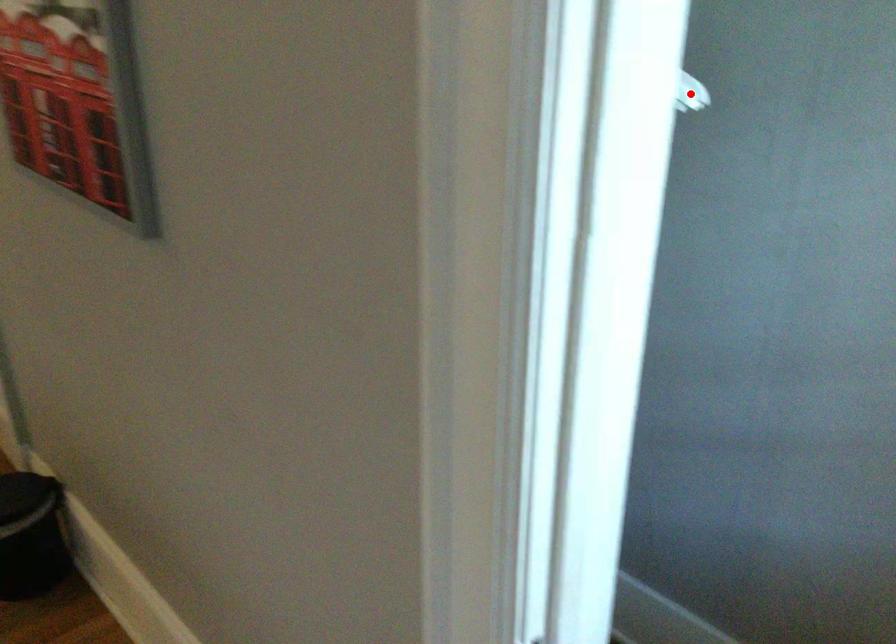
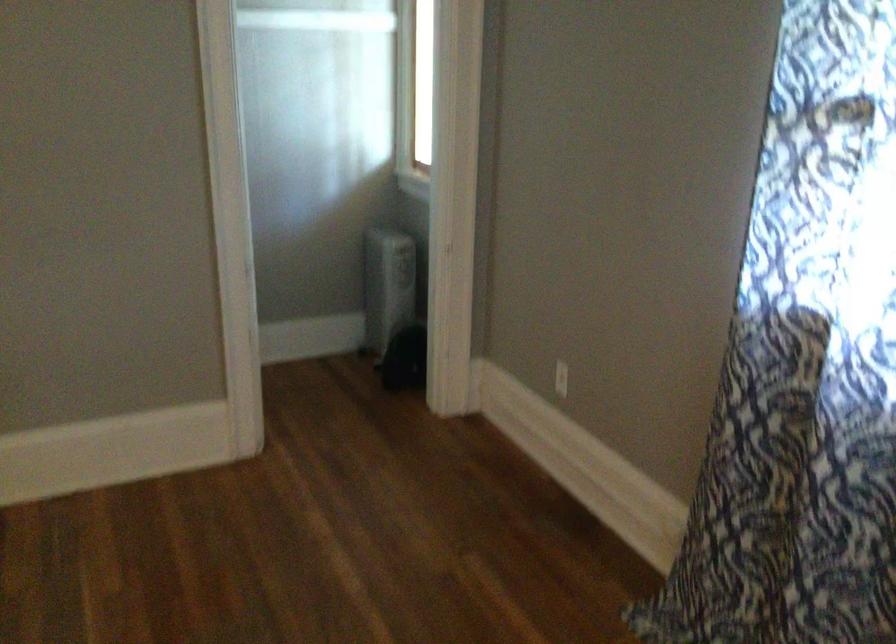
Question: I am providing you with two images of the same scene from different viewpoints. A red point is marked on the first image. Can you still see the location of the red point in image 2?

Choices:
 (A) Yes
 (B) No

Answer: (B)